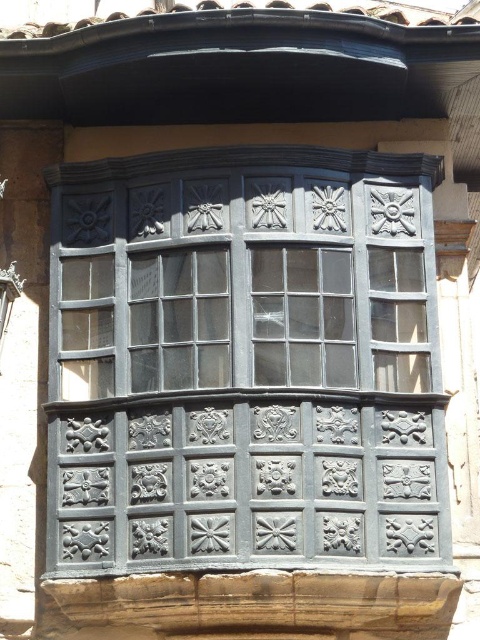
Question: Observing the image, what is the correct spatial positioning of matte black window frame at center in reference to clear glass window at center?

Choices:
 (A) right
 (B) left

Answer: (B)

Question: Does matte black window frame at center lie in front of clear glass window at center?

Choices:
 (A) no
 (B) yes

Answer: (B)

Question: Which point is closer to the camera?

Choices:
 (A) clear glass window at center
 (B) matte black window frame at center

Answer: (B)

Question: In this image, where is matte black window frame at center located relative to clear glass window at center?

Choices:
 (A) left
 (B) right

Answer: (A)